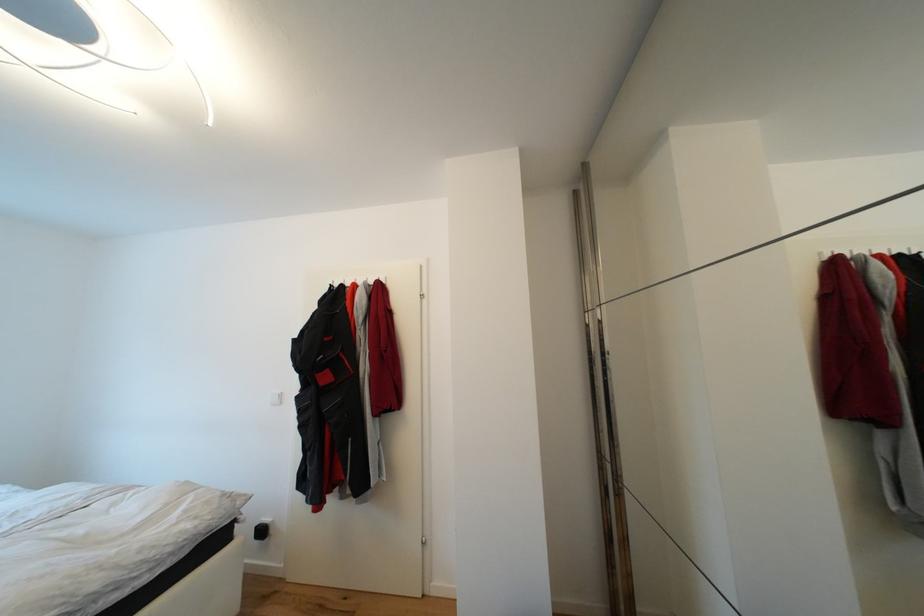
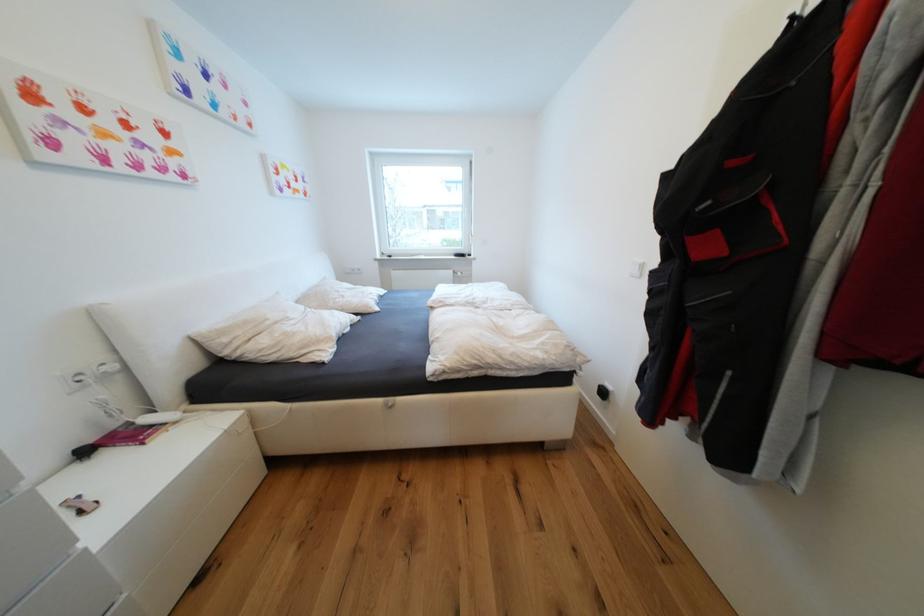
Based on the continuous images, in which direction is the camera rotating?

The camera rotated toward left-down.